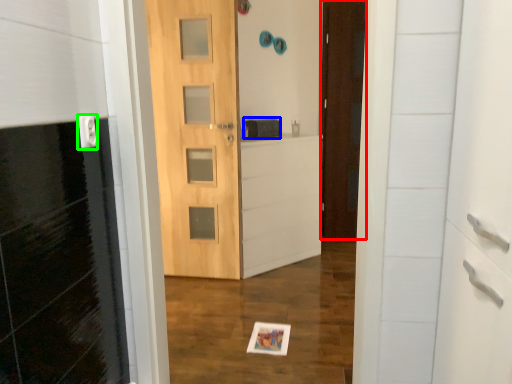
Question: Estimate the real-world distances between objects in this image. Which object is closer to door (highlighted by a red box), medicine cabinet (highlighted by a blue box) or electric outlet (highlighted by a green box)?

Choices:
 (A) medicine cabinet
 (B) electric outlet

Answer: (A)